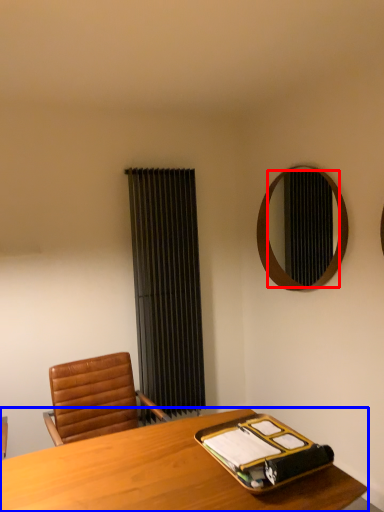
Question: Which point is closer to the camera, mirror (highlighted by a red box) or desk (highlighted by a blue box)?

Choices:
 (A) mirror
 (B) desk

Answer: (B)